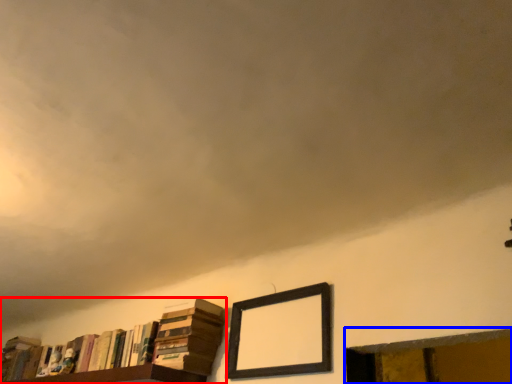
Question: Which object appears closest to the camera in this image, book (highlighted by a red box) or window frame (highlighted by a blue box)?

Choices:
 (A) book
 (B) window frame

Answer: (B)